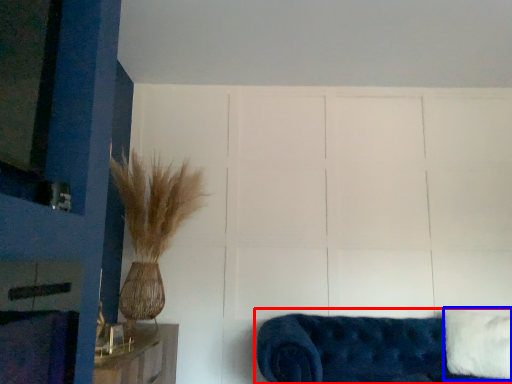
Question: Which point is closer to the camera, studio couch (highlighted by a red box) or pillow (highlighted by a blue box)?

Choices:
 (A) studio couch
 (B) pillow

Answer: (A)